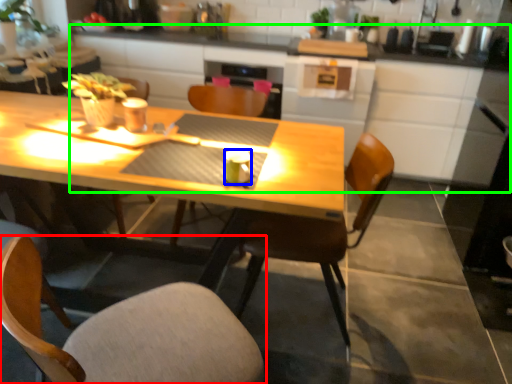
Question: Estimate the real-world distances between objects in this image. Which object is closer to chair (highlighted by a red box), coffee cup (highlighted by a blue box) or counter (highlighted by a green box)?

Choices:
 (A) coffee cup
 (B) counter

Answer: (A)